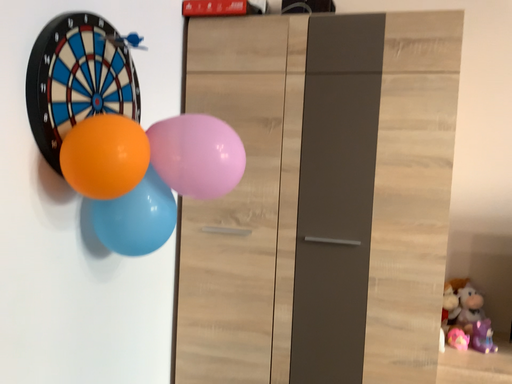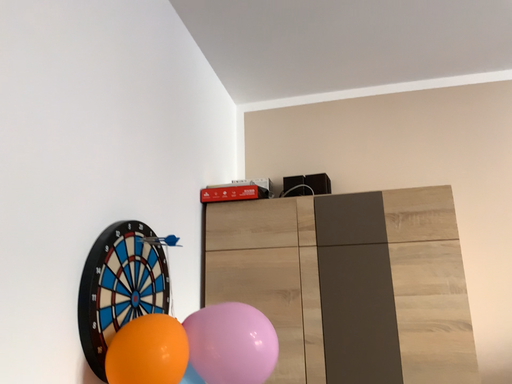
Question: Which way did the camera rotate in the video?

Choices:
 (A) rotated downward
 (B) rotated upward

Answer: (B)